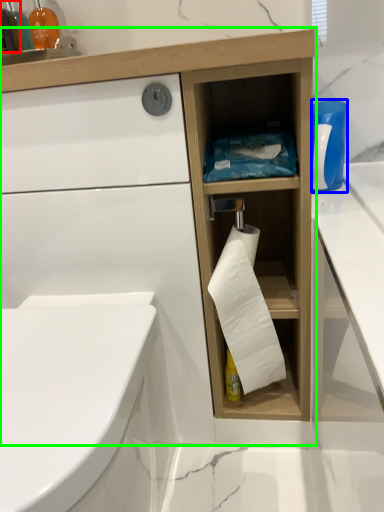
Question: Based on their relative distances, which object is farther from bottle (highlighted by a red box)? Choose from cleaning product (highlighted by a blue box) and bathroom cabinet (highlighted by a green box).

Choices:
 (A) cleaning product
 (B) bathroom cabinet

Answer: (A)